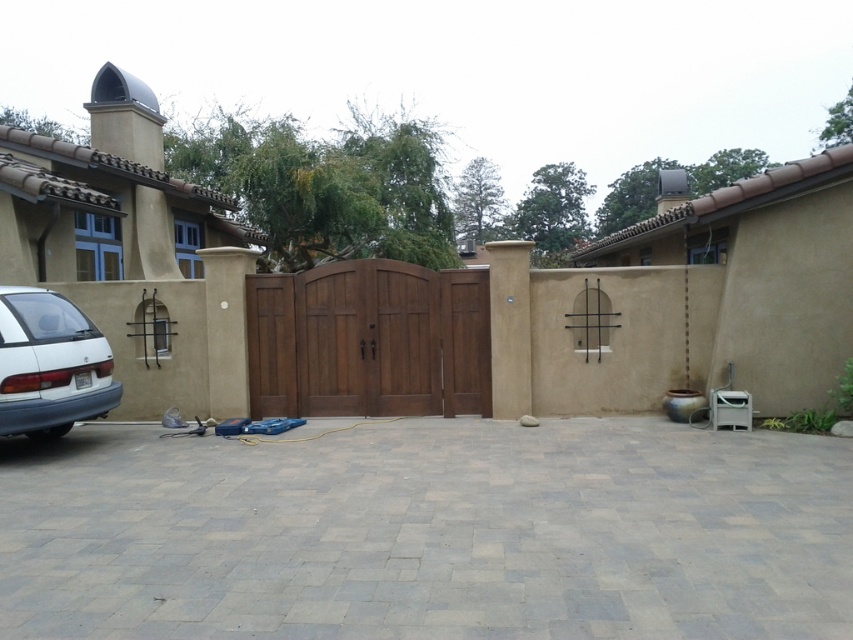
You are a delivery person trying to determine the best way to enter the property. You see the brown wooden gate at center and the brown wooden door at center. Which one is taller?

The brown wooden gate at center is much taller than the brown wooden door at center.

You are a delivery person trying to pass through the driveway. The brown wooden gate at center is closed, but you notice the brown wooden door at center. Can you walk through the space between them?

The brown wooden gate at center and brown wooden door at center are 25.30 inches apart from each other. Since 25.30 inches is approximately 2 feet, which is a narrow space, it might be possible to walk through but could be tight depending on your body size. However, the scene description mentions the gate is closed, so the door might be part of the gate. Check if the door is open before attempting to pass.

You are a delivery person trying to deliver a package to the property. You see the brown wooden door at center and the wooden gate at center. Which one should you open first to gain access to the property?

You should open the brown wooden door at center first because it has a larger size compared to the wooden gate at center, indicating it is the main entrance.